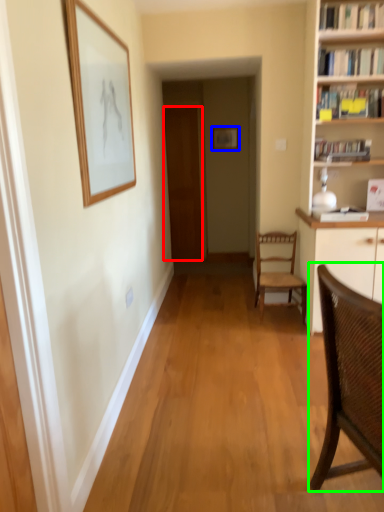
Question: Considering the real-world distances, which object is closest to door (highlighted by a red box)? picture frame (highlighted by a blue box) or chair (highlighted by a green box).

Choices:
 (A) picture frame
 (B) chair

Answer: (A)